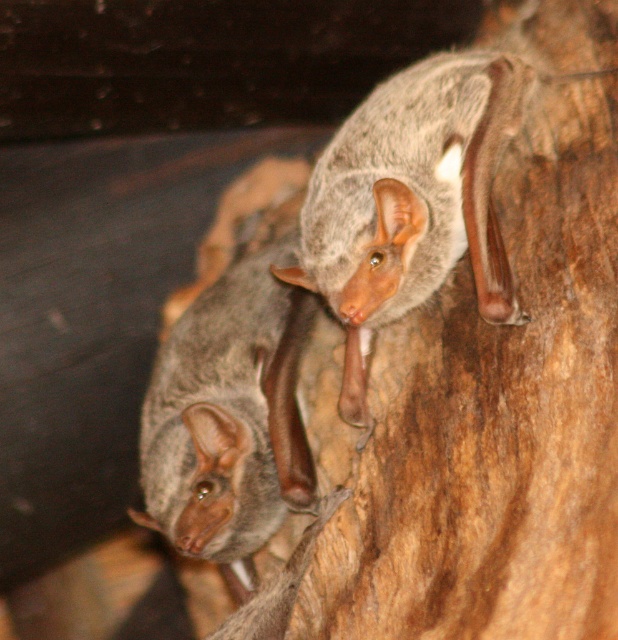
You are a wildlife photographer aiming to capture both the gray fur bat at upper right and the gray fur bat at lower left in a single frame. Considering their sizes, which bat might you need to position your camera closer to in order to ensure it fills the frame adequately?

The gray fur bat at upper right occupies less space than the gray fur bat at lower left, so you would need to position your camera closer to the gray fur bat at upper right to ensure it fills the frame adequately.

You are a wildlife photographer aiming to capture both the gray fur bat at upper right and the gray fur bat at lower left in a single frame. Based on their positions and sizes, which bat would appear closer to the camera in your photo?

The gray fur bat at upper right is not as tall as the gray fur bat at lower left, so the gray fur bat at lower left would appear closer to the camera since it is taller in the frame.

From the picture: You are a wildlife researcher observing bats in their natural habitat. You notice two gray fur bats perched on a wooden surface. Based on their size, which bat could potentially have a larger wingspan? Please refer to the bats labeled as gray fur bat at upper right and gray fur bat at lower left.

The gray fur bat at upper right has a larger width than the gray fur bat at lower left, so it could potentially have a larger wingspan.